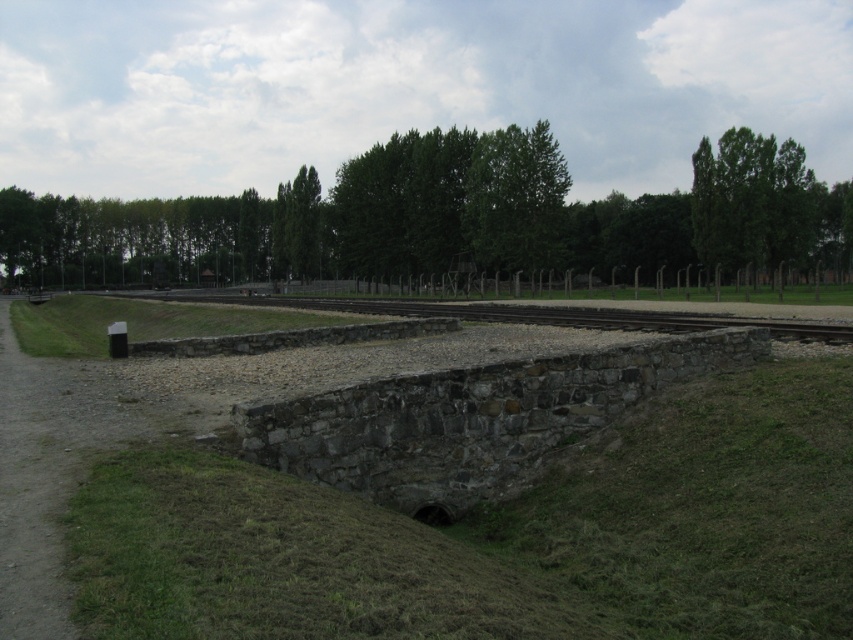
Question: Which point is closer to the camera?

Choices:
 (A) (691, 314)
 (B) (642, 529)

Answer: (B)

Question: Considering the relative positions of green leafy trees at upper center and green leafy tree at upper right in the image provided, where is green leafy trees at upper center located with respect to green leafy tree at upper right?

Choices:
 (A) above
 (B) below

Answer: (B)

Question: Can you confirm if green leafy tree at upper right is bigger than brown gravel train track at center?

Choices:
 (A) no
 (B) yes

Answer: (B)

Question: Which point is farther to the camera?

Choices:
 (A) (718, 417)
 (B) (496, 220)
 (C) (772, 262)

Answer: (B)

Question: Is gray stone bridge at center thinner than brown gravel train track at center?

Choices:
 (A) yes
 (B) no

Answer: (A)

Question: Which point appears closest to the camera in this image?

Choices:
 (A) (262, 298)
 (B) (366, 593)
 (C) (416, 180)
 (D) (757, 218)

Answer: (B)